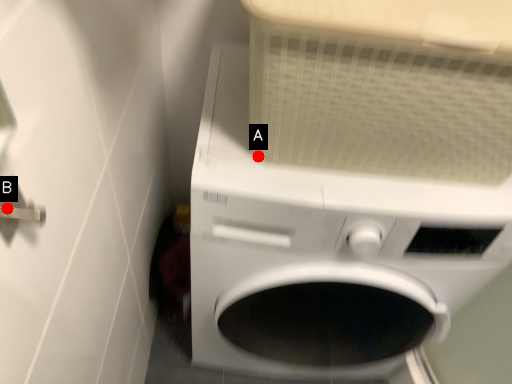
Question: Two points are circled on the image, labeled by A and B beside each circle. Which point is closer to the camera?

Choices:
 (A) A is closer
 (B) B is closer

Answer: (B)